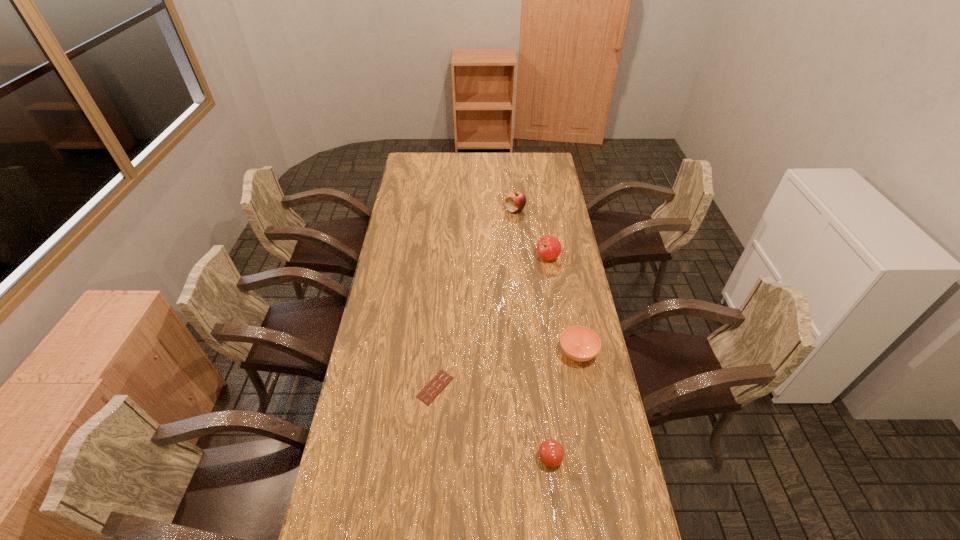
Identify the location of free spot located on the back of the fourth tallest object. The image size is (960, 540). (563, 271).

Find the location of `vacant space positioned on the front of the leftmost object`. vacant space positioned on the front of the leftmost object is located at coordinates (433, 421).

Image resolution: width=960 pixels, height=540 pixels. Identify the location of apple located in the right edge section of the desktop. (548, 247).

Image resolution: width=960 pixels, height=540 pixels. I want to click on soup bowl that is positioned at the right edge, so click(x=579, y=343).

In the image, there is a desktop. What are the coordinates of `free space at the left edge` in the screenshot? It's located at (378, 323).

In the image, there is a desktop. What are the coordinates of `vacant space at the right edge` in the screenshot? It's located at (544, 266).

The height and width of the screenshot is (540, 960). Identify the location of free space between the farthest object and the fourth nearest object. (532, 234).

Locate an element on the screen. The image size is (960, 540). vacant region between the second farthest apple and the farthest apple is located at coordinates [532, 234].

Find the location of a particular element. Image resolution: width=960 pixels, height=540 pixels. empty location between the farthest apple and the fourth tallest object is located at coordinates (546, 281).

Identify the location of free spot between the shortest apple and the soup bowl. (564, 406).